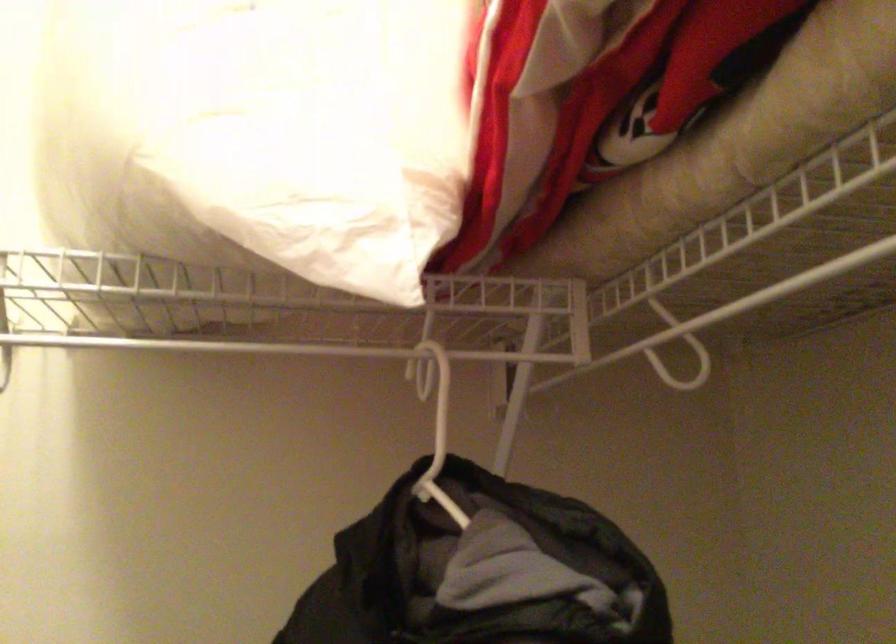
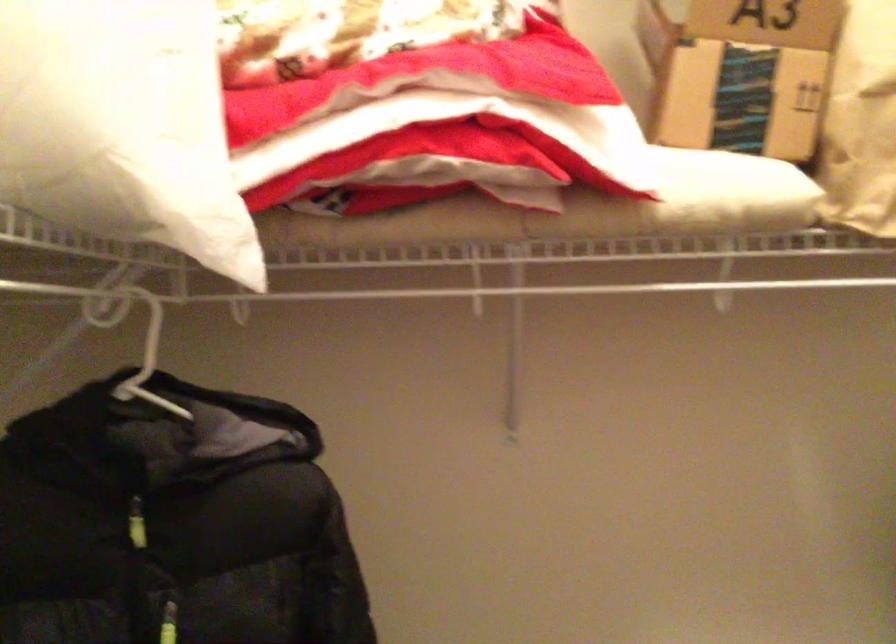
In the second image, find the point that corresponds to point 147,125 in the first image.

(123, 126)